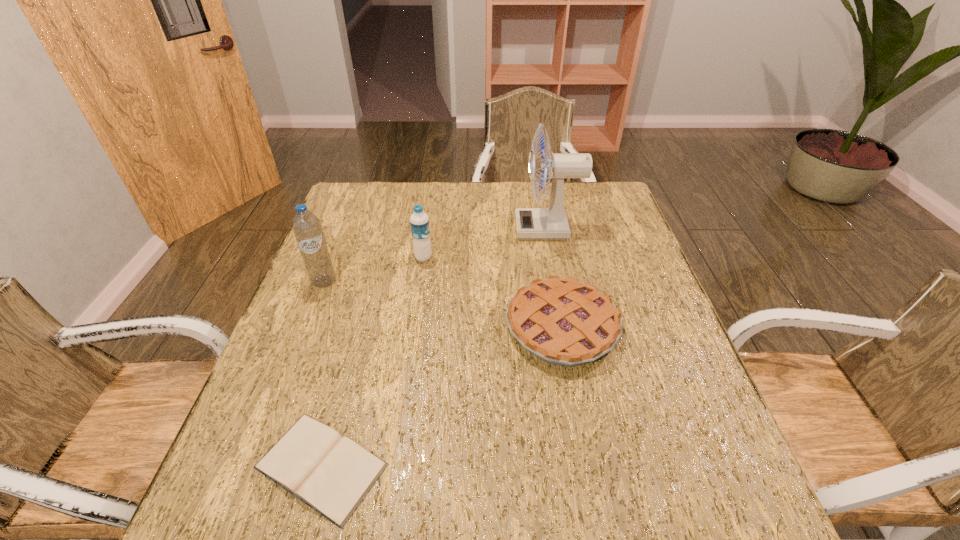
Where is `fan`? This screenshot has width=960, height=540. fan is located at coordinates (531, 223).

Locate an element on the screen. the tallest object is located at coordinates click(x=531, y=223).

You are a GUI agent. You are given a task and a screenshot of the screen. Output one action in this format:
    pyautogui.click(x=<x>, y=<y>)
    Task: Click on the nearer water bottle
    
    Given the screenshot: What is the action you would take?
    pyautogui.click(x=307, y=228)

In order to click on the left water bottle in this screenshot , I will do `click(307, 228)`.

The width and height of the screenshot is (960, 540). I want to click on the shorter water bottle, so click(419, 221).

Locate an element on the screen. The width and height of the screenshot is (960, 540). the third shortest object is located at coordinates (419, 221).

The image size is (960, 540). What are the coordinates of `the fourth tallest object` in the screenshot? It's located at (564, 322).

Where is `the nearest object`? The width and height of the screenshot is (960, 540). the nearest object is located at coordinates (332, 474).

I want to click on Bible, so click(332, 474).

Where is `vacant space located 0.150m on the front-facing side of the farthest object`? vacant space located 0.150m on the front-facing side of the farthest object is located at coordinates (467, 228).